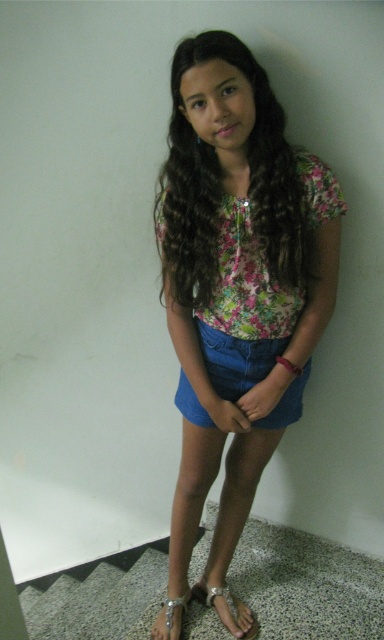
Question: Which of the following is the closest to the observer?

Choices:
 (A) (193, 410)
 (B) (233, 493)
 (C) (173, 634)
 (D) (240, 637)

Answer: (A)

Question: Estimate the real-world distances between objects in this image. Which object is closer to the metallic silver sandal at lower center?

Choices:
 (A) floral fabric blouse at center
 (B) fluffy brown hair at center
 (C) denim shorts at center
 (D) silver metallic sandal at lower center

Answer: (D)

Question: Is floral fabric blouse at center further to camera compared to denim shorts at center?

Choices:
 (A) yes
 (B) no

Answer: (B)

Question: Based on their relative distances, which object is farther from the floral fabric blouse at center?

Choices:
 (A) denim shorts at center
 (B) silver metallic sandal at lower center
 (C) fluffy brown hair at center
 (D) metallic silver sandal at lower center

Answer: (B)

Question: Is floral fabric blouse at center closer to the viewer compared to fluffy brown hair at center?

Choices:
 (A) no
 (B) yes

Answer: (A)

Question: Does floral fabric blouse at center appear over silver metallic sandal at lower center?

Choices:
 (A) no
 (B) yes

Answer: (B)